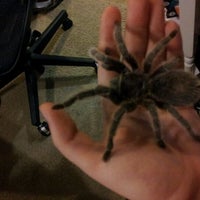
Find the location of `chair`. chair is located at coordinates (12, 37).